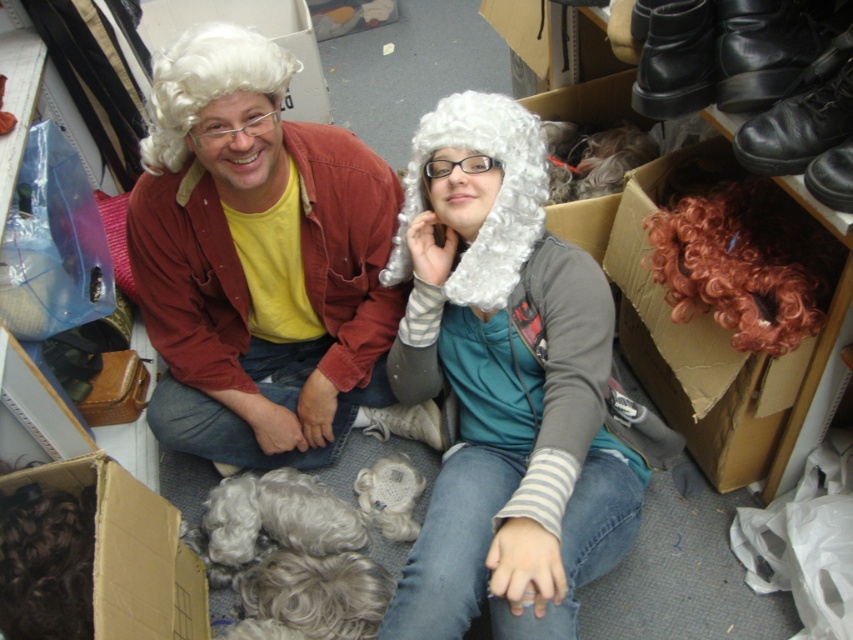
Question: Where is white fluffy wig at center located in relation to matte white wig at center in the image?

Choices:
 (A) right
 (B) left

Answer: (A)

Question: Can you confirm if white curly wig at center is positioned below white curly wig at upper left?

Choices:
 (A) no
 (B) yes

Answer: (B)

Question: Among these points, which one is nearest to the camera?

Choices:
 (A) (97, 504)
 (B) (491, 195)

Answer: (A)

Question: Among these points, which one is farthest from the camera?

Choices:
 (A) (737, 420)
 (B) (51, 476)
 (C) (494, 296)

Answer: (A)

Question: Among these points, which one is farthest from the camera?

Choices:
 (A) (166, 154)
 (B) (492, 93)
 (C) (184, 140)

Answer: (B)

Question: Can you confirm if matte white wig at center is wider than brown cardboard box at lower left?

Choices:
 (A) no
 (B) yes

Answer: (B)